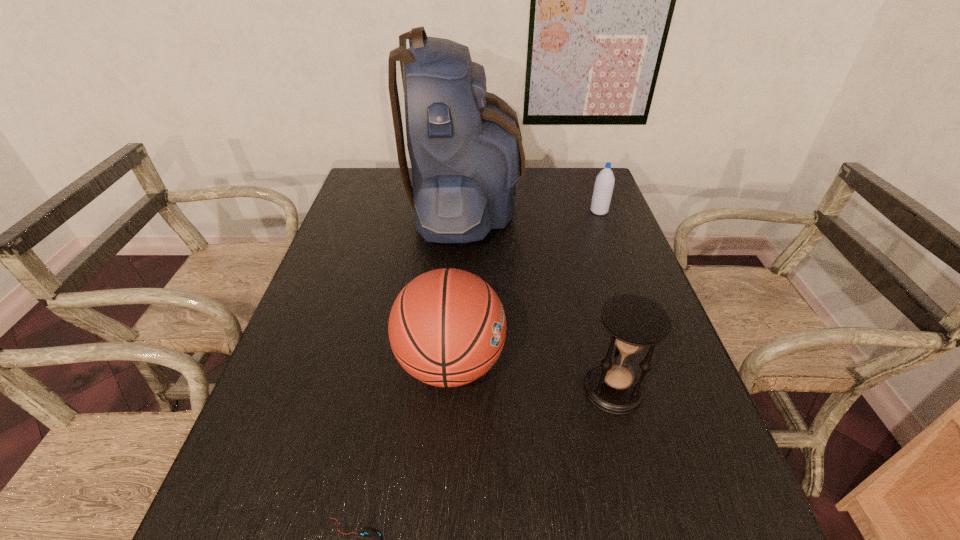
The image size is (960, 540). I want to click on the third closest object relative to the fourth tallest object, so click(x=635, y=322).

This screenshot has width=960, height=540. In order to click on blank area in the image that satisfies the following two spatial constraints: 1. at the front pocket of the rightmost object; 2. on the right side of the backpack in this screenshot , I will do `click(466, 211)`.

Image resolution: width=960 pixels, height=540 pixels. Find the location of `free space in the image that satisfies the following two spatial constraints: 1. at the front pocket of the tallest object; 2. on the right side of the second object from right to left`. free space in the image that satisfies the following two spatial constraints: 1. at the front pocket of the tallest object; 2. on the right side of the second object from right to left is located at coordinates (457, 388).

Locate an element on the screen. The image size is (960, 540). free location that satisfies the following two spatial constraints: 1. on the logo side of the basketball; 2. on the left side of the second object from right to left is located at coordinates (449, 388).

Where is `vacant space that satisfies the following two spatial constraints: 1. on the logo side of the fourth object from left to right; 2. on the right side of the basketball`? vacant space that satisfies the following two spatial constraints: 1. on the logo side of the fourth object from left to right; 2. on the right side of the basketball is located at coordinates (449, 388).